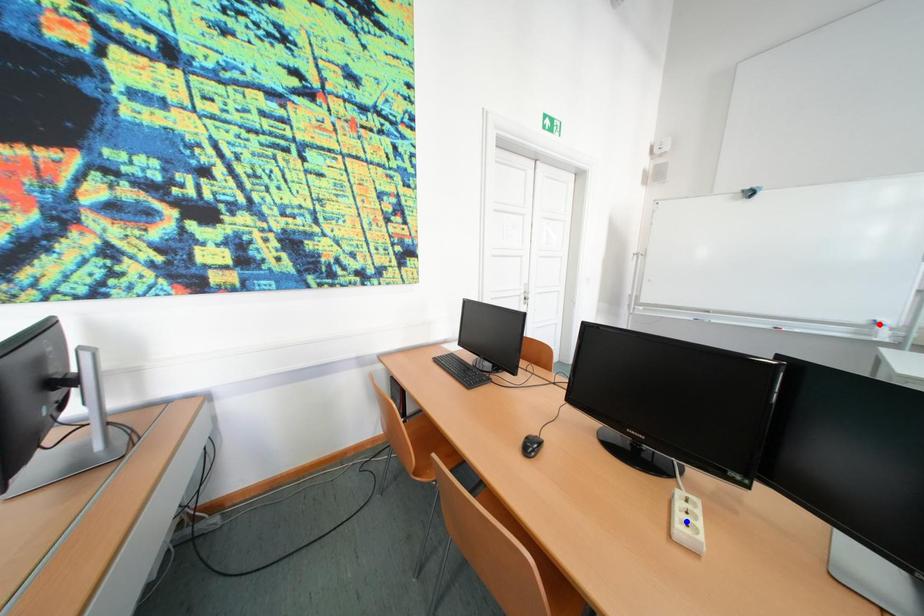
Question: In the image, two points are highlighted. Which point is nearer to the camera? Reply with the corresponding letter.

Choices:
 (A) blue point
 (B) red point

Answer: (A)